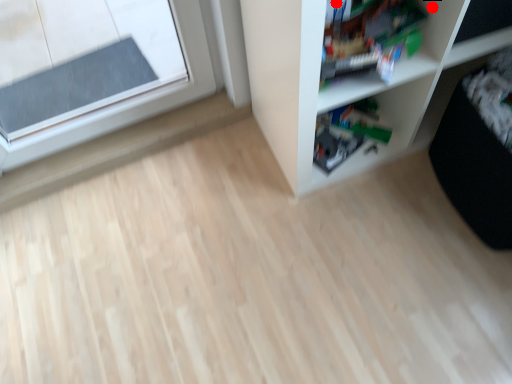
Question: Two points are circled on the image, labeled by A and B beside each circle. Among these points, which one is nearest to the camera?

Choices:
 (A) A is closer
 (B) B is closer

Answer: (A)